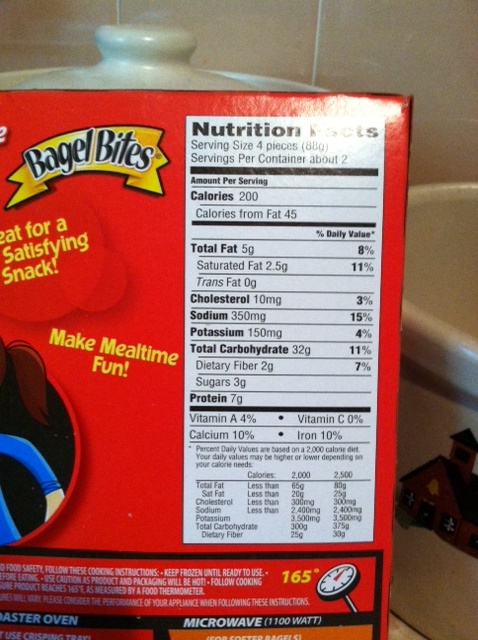
In order to click on tiles in this screenshot , I will do `click(435, 484)`, `click(445, 305)`, `click(457, 48)`.